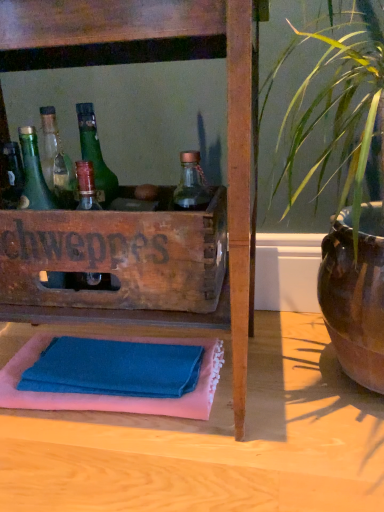
At what (x,y) coordinates should I click in order to perform the action: click on free space above blue cotton bath towel at lower center (from a real-world perspective). Please return your answer as a coordinate pair (x, y). This screenshot has width=384, height=512. Looking at the image, I should click on (104, 370).